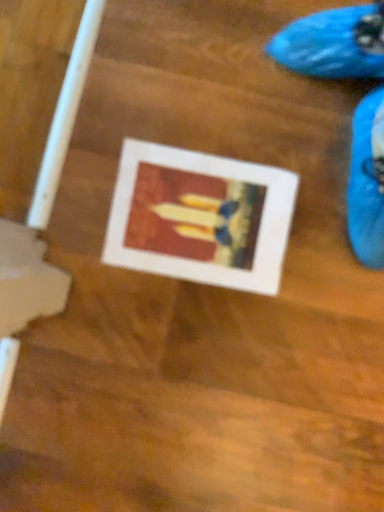
Locate an element on the screen. This screenshot has width=384, height=512. free location above white matte picture frame at center (from a real-world perspective) is located at coordinates (198, 222).